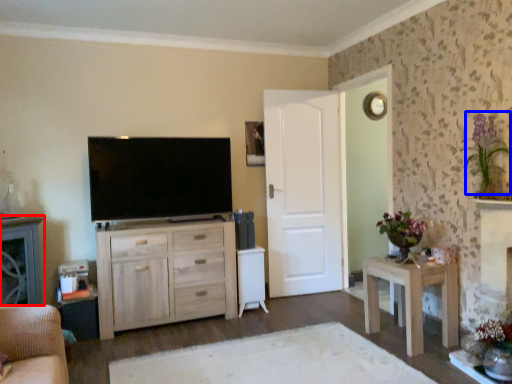
Question: Which point is further to the camera, cabinetry (highlighted by a red box) or floral arrangement (highlighted by a blue box)?

Choices:
 (A) cabinetry
 (B) floral arrangement

Answer: (A)